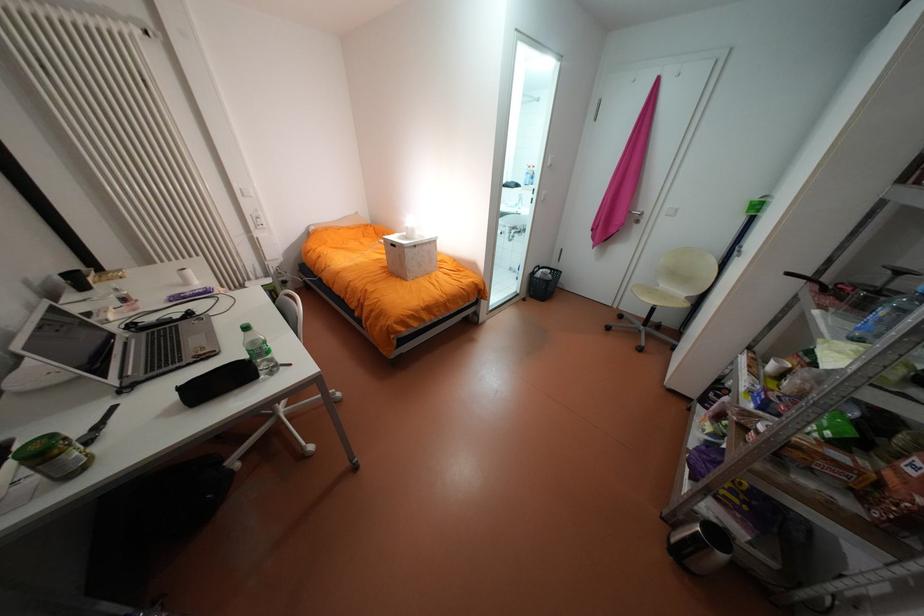
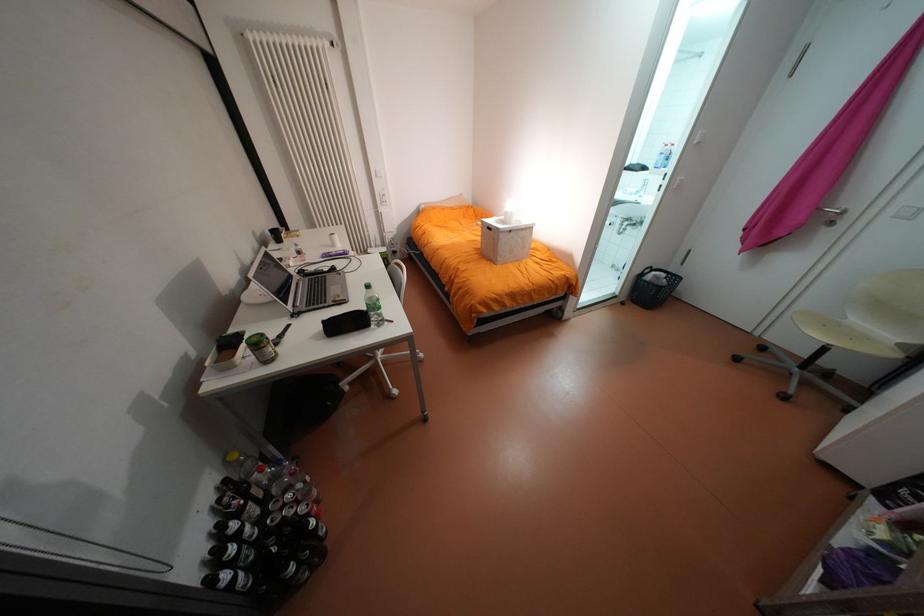
In the second image, find the point that corresponds to point (661, 290) in the first image.

(840, 323)